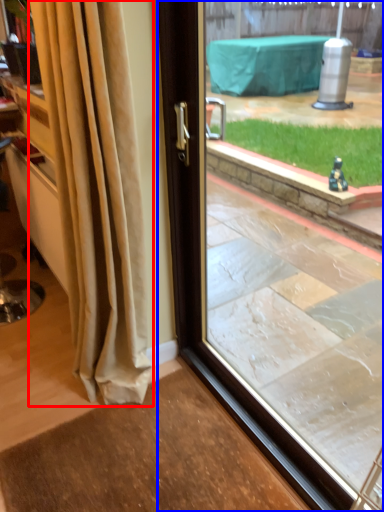
Question: Which of the following is the closest to the observer, curtain (highlighted by a red box) or window (highlighted by a blue box)?

Choices:
 (A) curtain
 (B) window

Answer: (B)